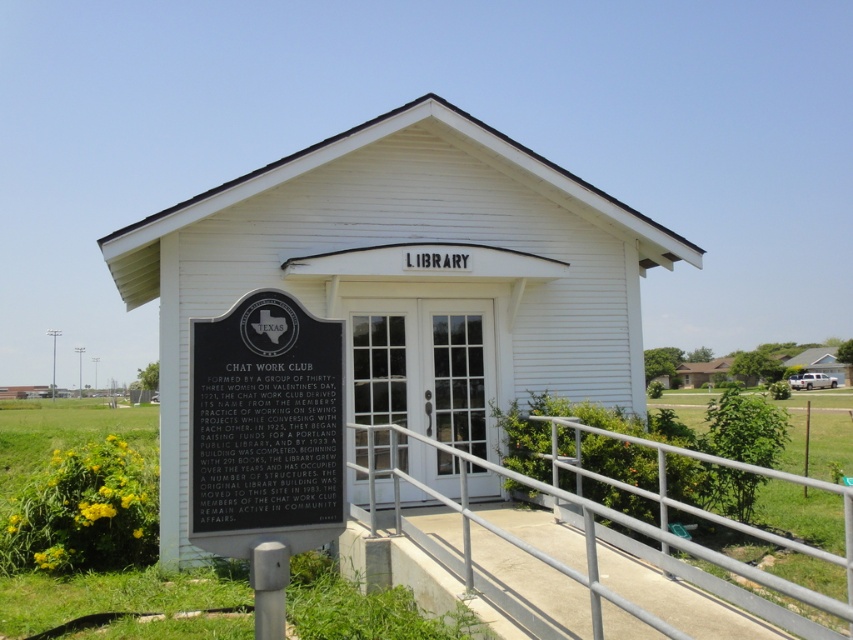
Question: Which object appears farthest from the camera in this image?

Choices:
 (A) silver metallic handrail at lower center
 (B) white wooden church at center

Answer: (B)

Question: Can you confirm if white wooden church at center is positioned to the left of black metal plaque at lower left?

Choices:
 (A) no
 (B) yes

Answer: (A)

Question: Can you confirm if white wooden church at center is positioned above black metal plaque at lower left?

Choices:
 (A) no
 (B) yes

Answer: (B)

Question: Based on their relative distances, which object is nearer to the silver metallic handrail at lower center?

Choices:
 (A) white wooden church at center
 (B) black metal plaque at lower left

Answer: (B)

Question: Which of these objects is positioned farthest from the silver metallic handrail at lower center?

Choices:
 (A) black metal plaque at lower left
 (B) white wooden church at center

Answer: (B)

Question: Is white wooden church at center closer to camera compared to silver metallic handrail at lower center?

Choices:
 (A) yes
 (B) no

Answer: (B)